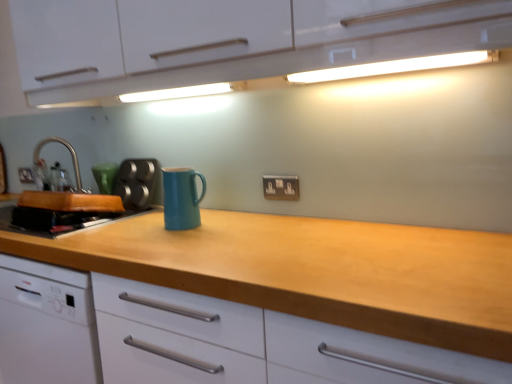
Question: From the image's perspective, relative to matte silver electric outlet at center, is metallic silver muffin tin at left above or below?

Choices:
 (A) above
 (B) below

Answer: (A)

Question: Based on their sizes in the image, would you say metallic silver muffin tin at left is bigger or smaller than matte silver electric outlet at center?

Choices:
 (A) big
 (B) small

Answer: (A)

Question: Based on their relative distances, which object is farther from the matte silver electric outlet at center?

Choices:
 (A) teal matte mug at center, which ranks as the second kitchen appliance in back-to-front order
 (B) metallic silver muffin tin at left
 (C) wooden cutting board at left, which ranks as the 2th kitchen appliance in right-to-left order
 (D) brushed metal tap at left
 (E) wooden at center

Answer: (D)

Question: Considering the real-world distances, which object is closest to the matte silver electric outlet at center?

Choices:
 (A) brushed metal tap at left
 (B) metallic silver muffin tin at left
 (C) white glossy cabinet at upper center
 (D) wooden at center
 (E) teal matte mug at center, which ranks as the second kitchen appliance in back-to-front order

Answer: (E)